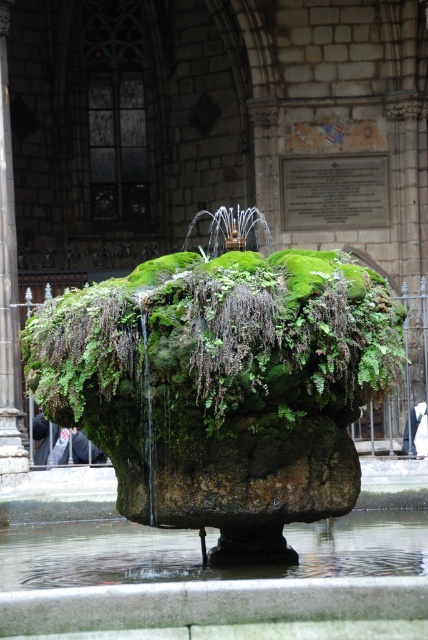
Looking at this image, does green mossy rock at center lie behind clear water at base center?

No.

Does point (238, 273) come in front of point (91, 545)?

Yes.

This screenshot has height=640, width=428. Find the location of `green mossy rock at center`. green mossy rock at center is located at coordinates (222, 387).

Can you confirm if clear water at base center is positioned to the right of dark gray stone pillar at center?

Correct, you'll find clear water at base center to the right of dark gray stone pillar at center.

Between clear water at base center and dark gray stone pillar at center, which one is positioned higher?

dark gray stone pillar at center is above.

Measure the distance between point [323,524] and camera.

A distance of 40.92 meters exists between point [323,524] and camera.

Where is `clear water at base center`? clear water at base center is located at coordinates (199, 552).

Does point (62, 413) lie behind point (8, 374)?

No, (62, 413) is in front of (8, 374).

Who is positioned more to the right, green mossy rock at center or dark gray stone pillar at center?

From the viewer's perspective, green mossy rock at center appears more on the right side.

Identify the location of green mossy rock at center. (222, 387).